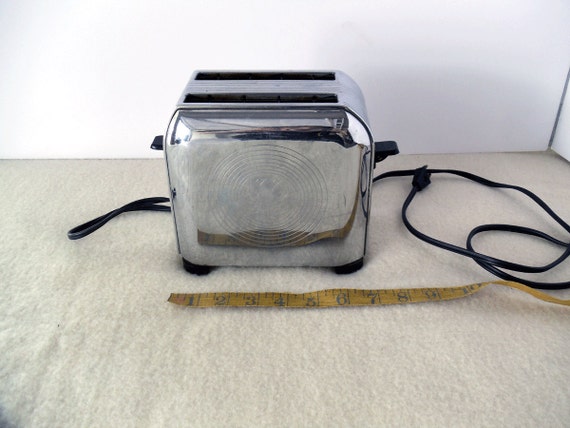
At what (x,y) coordinates should I click in order to perform the action: click on place to put bread. Please return your answer as a coordinate pair (x, y). This screenshot has width=570, height=428. Looking at the image, I should click on (256, 99), (262, 76).